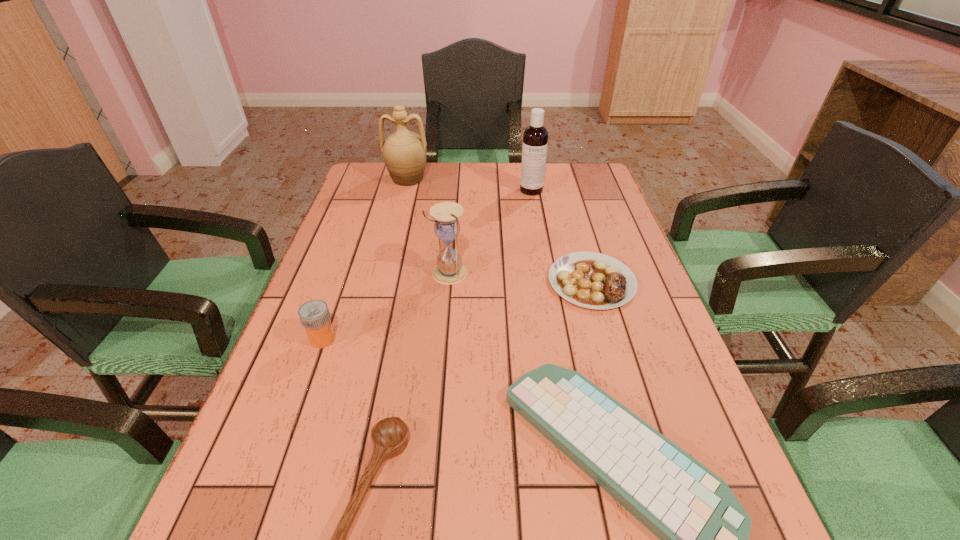
Where is `dishwasher detergent`? The height and width of the screenshot is (540, 960). dishwasher detergent is located at coordinates (535, 138).

Identify the location of pitcher. (404, 152).

This screenshot has width=960, height=540. What are the coordinates of `hourglass` in the screenshot? It's located at (449, 270).

At what (x,y) coordinates should I click in order to perform the action: click on the fourth tallest object. Please return your answer as a coordinate pair (x, y). This screenshot has height=540, width=960. Looking at the image, I should click on (314, 315).

Find the location of a particular element. The height and width of the screenshot is (540, 960). medicine is located at coordinates (314, 315).

The image size is (960, 540). I want to click on steak, so click(592, 280).

Locate an element on the screen. vacant region located on the label side of the dishwasher detergent is located at coordinates (542, 253).

This screenshot has height=540, width=960. Find the location of `free space located on the front of the pitcher`. free space located on the front of the pitcher is located at coordinates (400, 205).

Find the location of a particular element. This screenshot has width=960, height=540. free region located on the front of the hourglass is located at coordinates (441, 366).

At what (x,y) coordinates should I click in order to perform the action: click on vacant region located 0.330m on the label side of the fourth tallest object. Please return your answer as a coordinate pair (x, y). Image resolution: width=960 pixels, height=540 pixels. Looking at the image, I should click on (487, 339).